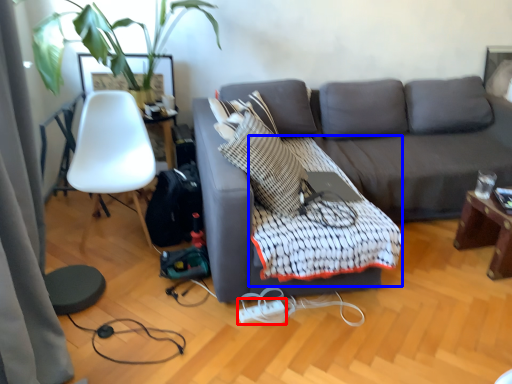
Question: Which point is further to the camera, extension cord (highlighted by a red box) or quilt (highlighted by a blue box)?

Choices:
 (A) extension cord
 (B) quilt

Answer: (A)